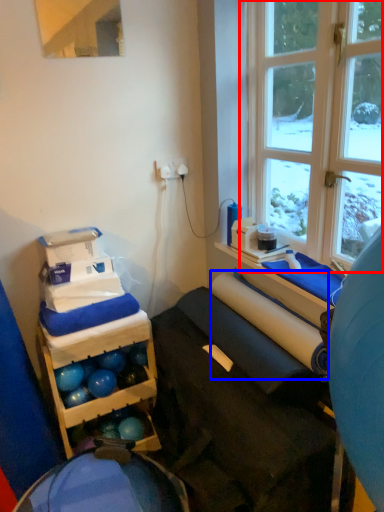
Question: Which point is closer to the camera, window (highlighted by a red box) or paper towel (highlighted by a blue box)?

Choices:
 (A) window
 (B) paper towel

Answer: (A)